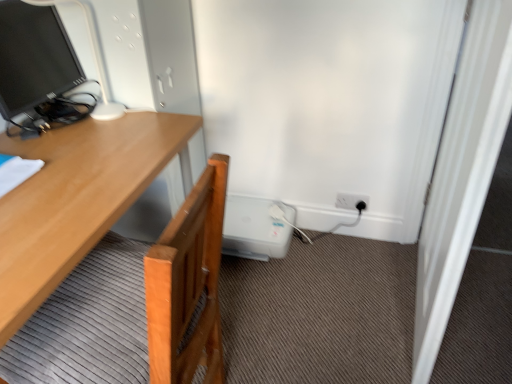
The width and height of the screenshot is (512, 384). Find the location of `white wooden screen door at right`. white wooden screen door at right is located at coordinates (462, 173).

Identify the location of matte black monitor at upper left. (34, 57).

Locate an element on the screen. The image size is (512, 384). black plastic power outlet at lower right is located at coordinates point(351,201).

Who is bigger, light wood desk at left or white wooden screen door at right?

With larger size is light wood desk at left.

Is point (2, 231) more distant than point (458, 234)?

No, (2, 231) is in front of (458, 234).

Locate an element on the screen. screen door located above the light wood desk at left (from the image's perspective) is located at coordinates (462, 173).

Is light wood desk at left in front of white wooden screen door at right?

Yes, light wood desk at left is closer to the viewer.

Who is smaller, light wood desk at left or matte black monitor at upper left?

Smaller between the two is matte black monitor at upper left.

Between light wood desk at left and matte black monitor at upper left, which one has smaller width?

matte black monitor at upper left.

From a real-world perspective, between light wood desk at left and matte black monitor at upper left, who is vertically higher?

In real-world perspective, matte black monitor at upper left is above.

Could you tell me if light wood desk at left is turned towards matte black monitor at upper left?

No.

In the image, is white wooden screen door at right on the left side or the right side of light wood desk at left?

From the image, it's evident that white wooden screen door at right is to the right of light wood desk at left.

Find the location of a particular element. This screenshot has height=384, width=512. screen door above the light wood desk at left (from the image's perspective) is located at coordinates (462, 173).

Is white wooden screen door at right oriented towards light wood desk at left?

Yes, white wooden screen door at right faces towards light wood desk at left.

Is white wooden screen door at right in front of or behind black plastic power outlet at lower right in the image?

In the image, white wooden screen door at right appears in front of black plastic power outlet at lower right.

From a real-world perspective, is white wooden screen door at right positioned above or below black plastic power outlet at lower right?

white wooden screen door at right is above black plastic power outlet at lower right.

Does white wooden screen door at right appear on the left side of black plastic power outlet at lower right?

No, white wooden screen door at right is not to the left of black plastic power outlet at lower right.

What's the angular difference between white wooden screen door at right and black plastic power outlet at lower right's facing directions?

90.9 degrees.

This screenshot has width=512, height=384. What are the coordinates of `television above the black plastic power outlet at lower right (from a real-world perspective)` in the screenshot? It's located at (34, 57).

Considering the sizes of objects matte black monitor at upper left and black plastic power outlet at lower right in the image provided, who is bigger, matte black monitor at upper left or black plastic power outlet at lower right?

matte black monitor at upper left is bigger.

Are matte black monitor at upper left and black plastic power outlet at lower right beside each other?

No, matte black monitor at upper left is not next to black plastic power outlet at lower right.

Can you confirm if matte black monitor at upper left is shorter than black plastic power outlet at lower right?

Incorrect, the height of matte black monitor at upper left does not fall short of that of black plastic power outlet at lower right.

Which is more to the left, white wooden screen door at right or matte black monitor at upper left?

From the viewer's perspective, matte black monitor at upper left appears more on the left side.

Considering the sizes of objects white wooden screen door at right and matte black monitor at upper left in the image provided, who is smaller, white wooden screen door at right or matte black monitor at upper left?

With smaller size is matte black monitor at upper left.

Based on the photo, does white wooden screen door at right turn towards matte black monitor at upper left?

Yes, white wooden screen door at right is facing matte black monitor at upper left.

From the image's perspective, relative to black plastic power outlet at lower right, is light wood desk at left above or below?

Based on their image positions, light wood desk at left is located beneath black plastic power outlet at lower right.

Which is correct: light wood desk at left is inside black plastic power outlet at lower right, or outside of it?

light wood desk at left cannot be found inside black plastic power outlet at lower right.

Looking at this image, considering the relative sizes of light wood desk at left and black plastic power outlet at lower right in the image provided, is light wood desk at left shorter than black plastic power outlet at lower right?

No.

Is point (11, 321) less distant than point (343, 207)?

Yes, point (11, 321) is closer to viewer.

The image size is (512, 384). In order to click on screen door behind the light wood desk at left in this screenshot , I will do `click(462, 173)`.

Locate an element on the screen. The width and height of the screenshot is (512, 384). television that is on the left side of light wood desk at left is located at coordinates (34, 57).

When comparing their distances from light wood desk at left, does matte black monitor at upper left or black plastic power outlet at lower right seem closer?

matte black monitor at upper left.

From the image, which object appears to be nearer to light wood desk at left, matte black monitor at upper left or white wooden screen door at right?

matte black monitor at upper left is positioned closer to the anchor light wood desk at left.

Based on their spatial positions, is white wooden screen door at right or light wood desk at left closer to matte black monitor at upper left?

The object closer to matte black monitor at upper left is light wood desk at left.

Estimate the real-world distances between objects in this image. Which object is closer to matte black monitor at upper left, black plastic power outlet at lower right or white wooden screen door at right?

Among the two, white wooden screen door at right is located nearer to matte black monitor at upper left.

In the scene shown: When comparing their distances from black plastic power outlet at lower right, does white wooden screen door at right or matte black monitor at upper left seem further?

matte black monitor at upper left lies further to black plastic power outlet at lower right than the other object.

Which object lies further to the anchor point black plastic power outlet at lower right, matte black monitor at upper left or light wood desk at left?

matte black monitor at upper left is positioned further to the anchor black plastic power outlet at lower right.

Considering their positions, is black plastic power outlet at lower right positioned closer to white wooden screen door at right than matte black monitor at upper left?

black plastic power outlet at lower right is positioned closer to the anchor white wooden screen door at right.

When comparing their distances from black plastic power outlet at lower right, does light wood desk at left or white wooden screen door at right seem further?

light wood desk at left is further to black plastic power outlet at lower right.

Where is `television located between light wood desk at left and black plastic power outlet at lower right in the depth direction`? The image size is (512, 384). television located between light wood desk at left and black plastic power outlet at lower right in the depth direction is located at coordinates (34, 57).

Find the location of a particular element. screen door between light wood desk at left and black plastic power outlet at lower right along the z-axis is located at coordinates (462, 173).

This screenshot has width=512, height=384. Find the location of `power outlet between matte black monitor at upper left and white wooden screen door at right`. power outlet between matte black monitor at upper left and white wooden screen door at right is located at coordinates (351, 201).

The height and width of the screenshot is (384, 512). Find the location of `desk between matte black monitor at upper left and white wooden screen door at right from left to right`. desk between matte black monitor at upper left and white wooden screen door at right from left to right is located at coordinates (78, 198).